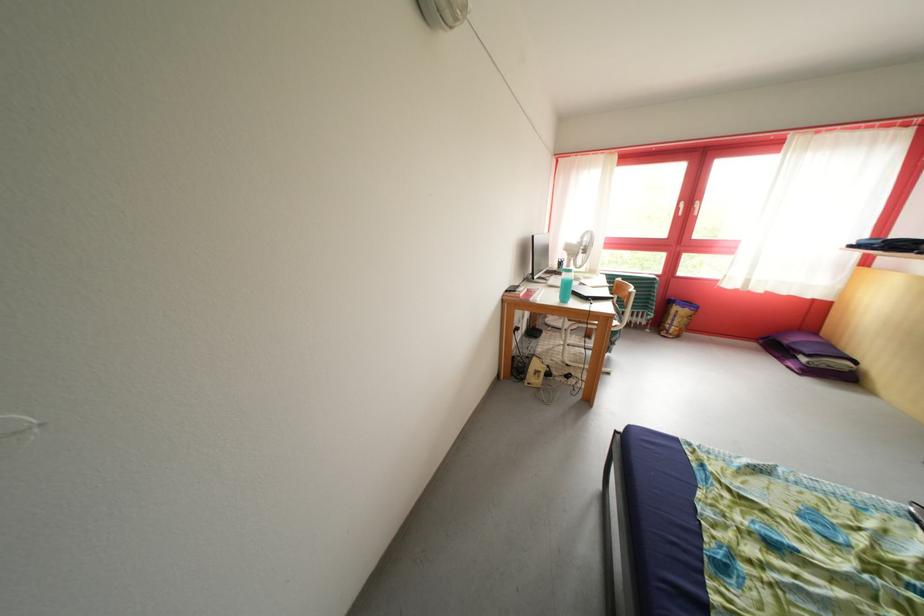
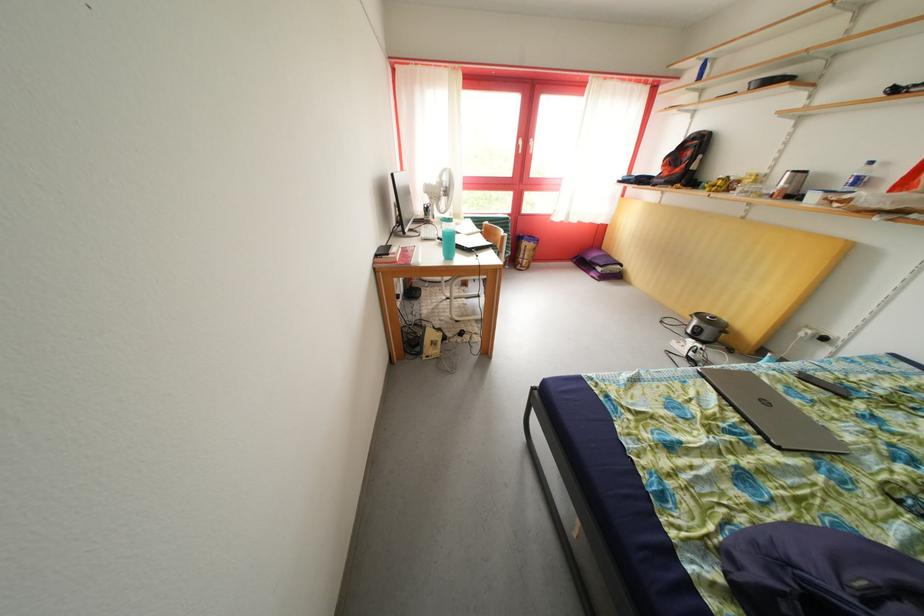
In the second image, find the point that corresponds to (811,365) in the first image.

(608, 275)